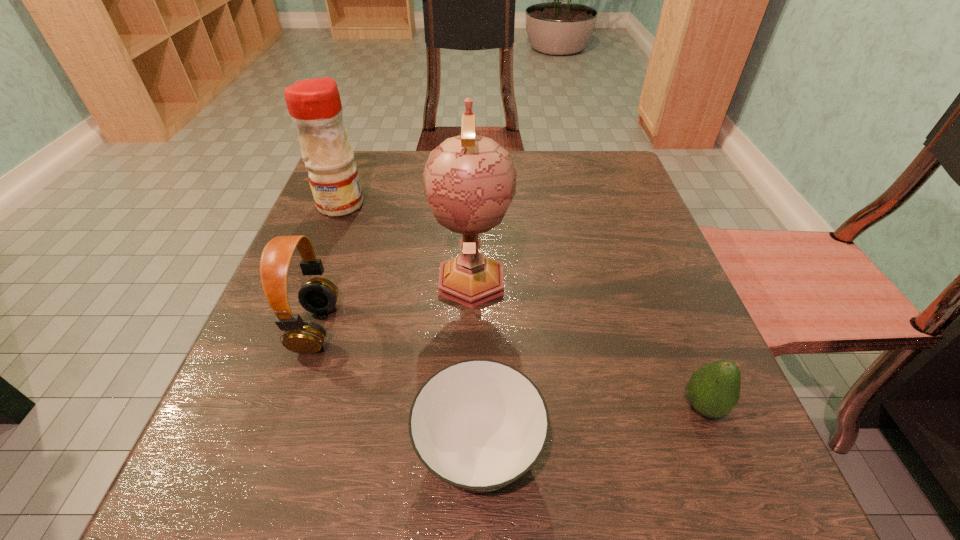
Locate an element on the screen. The image size is (960, 540). vacant space located on the right of the soup bowl is located at coordinates (588, 451).

At what (x,y) coordinates should I click in order to perform the action: click on object present at the far edge. Please return your answer as a coordinate pair (x, y). Looking at the image, I should click on [314, 105].

Find the location of a particular element. object at the near edge is located at coordinates (478, 425).

What are the coordinates of `condiment that is at the left edge` in the screenshot? It's located at (314, 105).

This screenshot has height=540, width=960. I want to click on headset at the left edge, so click(318, 295).

The image size is (960, 540). Find the location of `object at the right edge`. object at the right edge is located at coordinates (713, 390).

Find the location of `object located at the far left corner`. object located at the far left corner is located at coordinates (314, 105).

In the image, there is a desktop. At what (x,y) coordinates should I click in order to perform the action: click on free region at the far edge. Please return your answer as a coordinate pair (x, y). Looking at the image, I should click on (404, 179).

Locate an element on the screen. The image size is (960, 540). free location at the left edge of the desktop is located at coordinates (360, 303).

The width and height of the screenshot is (960, 540). In the image, there is a desktop. Identify the location of vacant space at the right edge. (696, 347).